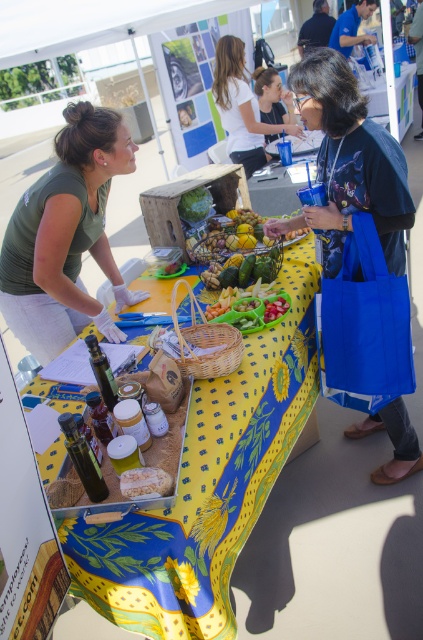
From the picture: You are a food vendor at the event and need to place a 50 cm wide sign between the yellow printed fabric at center and the crumbly brown bread at center on the table. Will the sign fit between them?

The yellow printed fabric at center and crumbly brown bread at center are 48.96 centimeters apart, so the 50 cm wide sign will not fit between them as the distance is smaller than the sign.

Based on the photo, you are at a community event and see a yellow printed fabric at center and a crumbly brown bread at center on a table. Which item is located to the right of the other?

The yellow printed fabric at center is positioned on the right side of crumbly brown bread at center.

You are at the event and want to grab the crumbly brown bread at center. You need to reach past the smooth plastic tray at center. Is the bread behind the tray or in front of it?

The smooth plastic tray at center is further to the viewer than crumbly brown bread at center, so the bread is behind the tray.